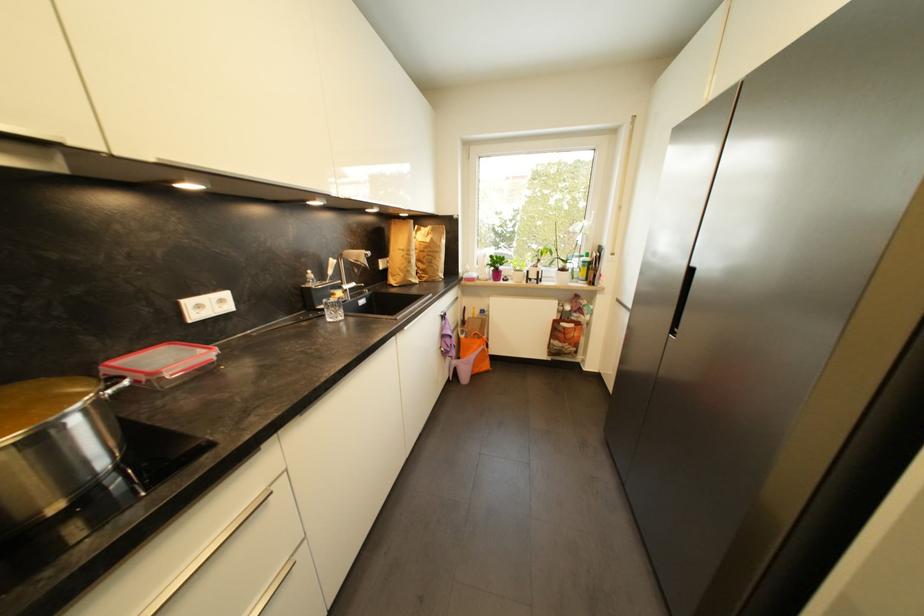
Find the location of a particular element. black refrigerator handle is located at coordinates (681, 301).